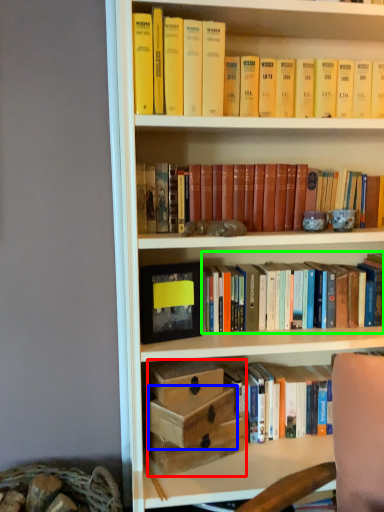
Question: Estimate the real-world distances between objects in this image. Which object is farther from box (highlighted by a red box), box (highlighted by a blue box) or book (highlighted by a green box)?

Choices:
 (A) box
 (B) book

Answer: (B)